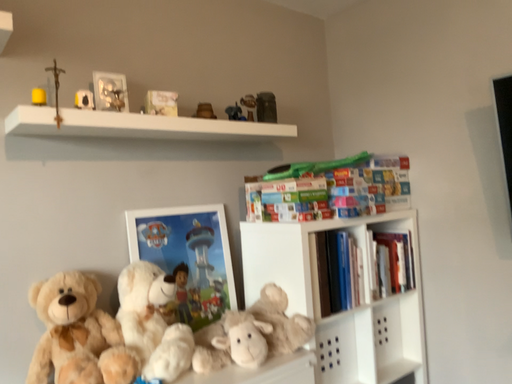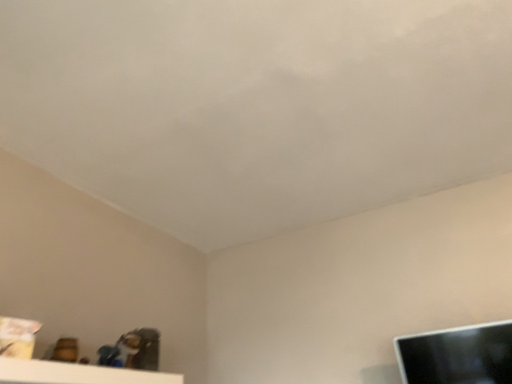
Question: Which way did the camera rotate in the video?

Choices:
 (A) rotated upward
 (B) rotated downward

Answer: (A)